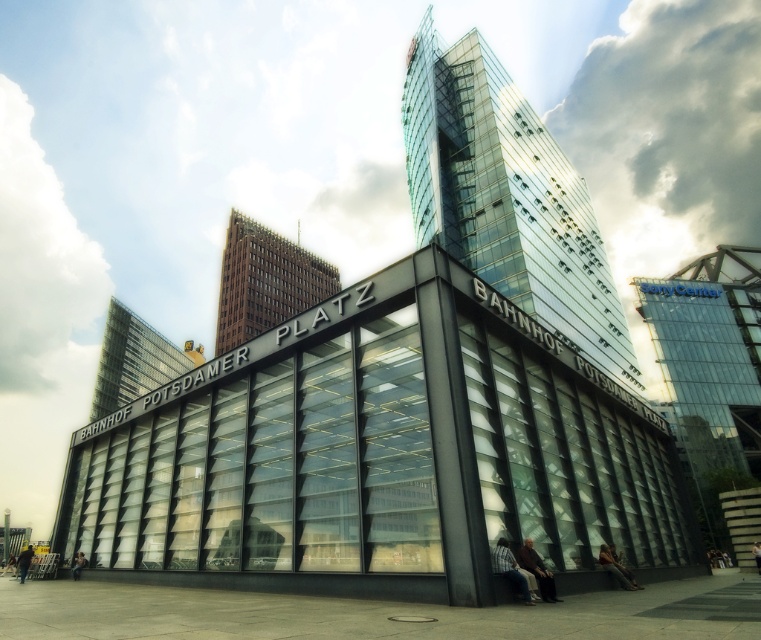
Question: Can you confirm if glassy steel structure at center is wider than blue denim jeans at lower center?

Choices:
 (A) yes
 (B) no

Answer: (A)

Question: Based on their relative distances, which object is farther from the glassy steel structure at center?

Choices:
 (A) white cotton tank top at center
 (B) dark gray concrete person at lower left

Answer: (A)

Question: Does dark blue jeans at lower left have a smaller size compared to dark gray concrete person at lower left?

Choices:
 (A) yes
 (B) no

Answer: (B)

Question: Which point is closer to the camera?

Choices:
 (A) dark gray concrete person at lower left
 (B) dark blue jeans at lower left

Answer: (B)

Question: Is brown leather jacket at lower right below leather jacket at lower right?

Choices:
 (A) no
 (B) yes

Answer: (A)

Question: Among these points, which one is nearest to the camera?

Choices:
 (A) (263, 552)
 (B) (634, 586)

Answer: (A)